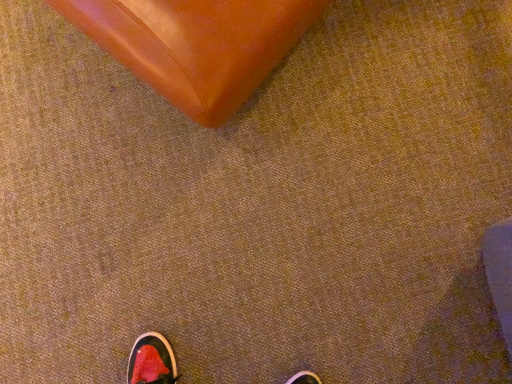
Describe the element at coordinates (196, 45) in the screenshot. I see `leather couch at upper left` at that location.

This screenshot has height=384, width=512. Identify the location of leather couch at upper left. (196, 45).

Identify the location of leather couch at upper left. (196, 45).